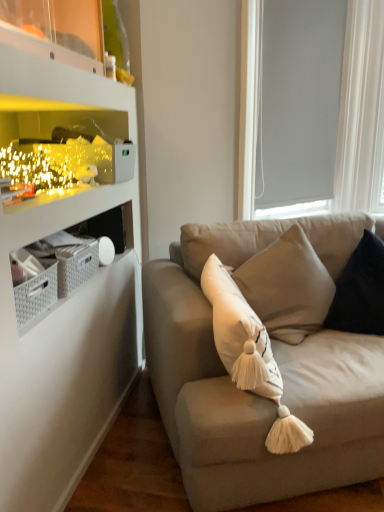
The image size is (384, 512). Describe the element at coordinates (360, 290) in the screenshot. I see `dark blue velvet pillow at right` at that location.

This screenshot has height=512, width=384. Find the location of `white matte window screen at upper right`. white matte window screen at upper right is located at coordinates (361, 110).

Which is behind, dark blue velvet pillow at right or suede beige couch at center?

dark blue velvet pillow at right.

Is dark blue velvet pillow at right at the right side of suede beige couch at center?

Yes.

Is dark blue velvet pillow at right wider or thinner than suede beige couch at center?

In the image, dark blue velvet pillow at right appears to be more narrow than suede beige couch at center.

Is suede beige couch at center far from white matte window screen at upper right?

Yes, suede beige couch at center and white matte window screen at upper right are located far from each other.

In the scene shown: From the image's perspective, is suede beige couch at center over white matte window screen at upper right?

Incorrect, from the image's perspective, suede beige couch at center is lower than white matte window screen at upper right.

Does point (317, 442) come closer to viewer compared to point (255, 153)?

Yes, it is.

Is dark blue velvet pillow at right positioned with its back to white matte window screen at upper right?

No, white matte window screen at upper right is not at the back of dark blue velvet pillow at right.

From the image's perspective, is dark blue velvet pillow at right above white matte window screen at upper right?

No, from the image's perspective, dark blue velvet pillow at right is not on top of white matte window screen at upper right.

Which of these two, dark blue velvet pillow at right or white matte window screen at upper right, stands shorter?

With less height is dark blue velvet pillow at right.

Identify the location of window screen above the dark blue velvet pillow at right (from the image's perspective). (361, 110).

Is dark blue velvet pillow at right at the back of suede beige couch at center?

Yes, suede beige couch at center is positioned with its back facing dark blue velvet pillow at right.

Can you confirm if suede beige couch at center is shorter than dark blue velvet pillow at right?

No.

Is suede beige couch at center to the right of dark blue velvet pillow at right from the viewer's perspective?

No.

Consider the image. From a real-world perspective, is white matte window screen at upper right under suede beige couch at center?

No, from a real-world perspective, white matte window screen at upper right is not below suede beige couch at center.

Which of these two, white matte window screen at upper right or suede beige couch at center, is bigger?

suede beige couch at center.

Which of these two, white matte window screen at upper right or suede beige couch at center, stands taller?

white matte window screen at upper right.

In the image, there is a suede beige couch at center. In order to click on window screen above it (from the image's perspective) in this screenshot , I will do `click(361, 110)`.

The width and height of the screenshot is (384, 512). In the image, there is a dark blue velvet pillow at right. In order to click on window screen above it (from the image's perspective) in this screenshot , I will do `click(361, 110)`.

From a real-world perspective, is white matte window screen at upper right physically below dark blue velvet pillow at right?

No, from a real-world perspective, white matte window screen at upper right is not below dark blue velvet pillow at right.

From the image's perspective, which object appears higher, white matte window screen at upper right or dark blue velvet pillow at right?

From the image's view, white matte window screen at upper right is above.

Does white matte window screen at upper right have a greater width compared to dark blue velvet pillow at right?

Incorrect, the width of white matte window screen at upper right does not surpass that of dark blue velvet pillow at right.

This screenshot has width=384, height=512. In the image, there is a suede beige couch at center. Identify the location of pillow above it (from the image's perspective). (360, 290).

The width and height of the screenshot is (384, 512). I want to click on studio couch that is in front of the white matte window screen at upper right, so click(x=251, y=393).

Considering their positions, is white matte window screen at upper right positioned closer to dark blue velvet pillow at right than suede beige couch at center?

suede beige couch at center is positioned closer to the anchor dark blue velvet pillow at right.

Looking at the image, which one is located closer to suede beige couch at center, dark blue velvet pillow at right or white matte window screen at upper right?

dark blue velvet pillow at right is positioned closer to the anchor suede beige couch at center.

Looking at the image, which one is located closer to dark blue velvet pillow at right, suede beige couch at center or white matte window screen at upper right?

The object closer to dark blue velvet pillow at right is suede beige couch at center.

From the image, which object appears to be nearer to white matte window screen at upper right, suede beige couch at center or dark blue velvet pillow at right?

dark blue velvet pillow at right is positioned closer to the anchor white matte window screen at upper right.

Based on their spatial positions, is dark blue velvet pillow at right or suede beige couch at center further from white matte window screen at upper right?

suede beige couch at center is further to white matte window screen at upper right.

Based on their spatial positions, is white matte window screen at upper right or dark blue velvet pillow at right further from suede beige couch at center?

white matte window screen at upper right.

This screenshot has height=512, width=384. I want to click on pillow that lies between white matte window screen at upper right and suede beige couch at center from top to bottom, so click(360, 290).